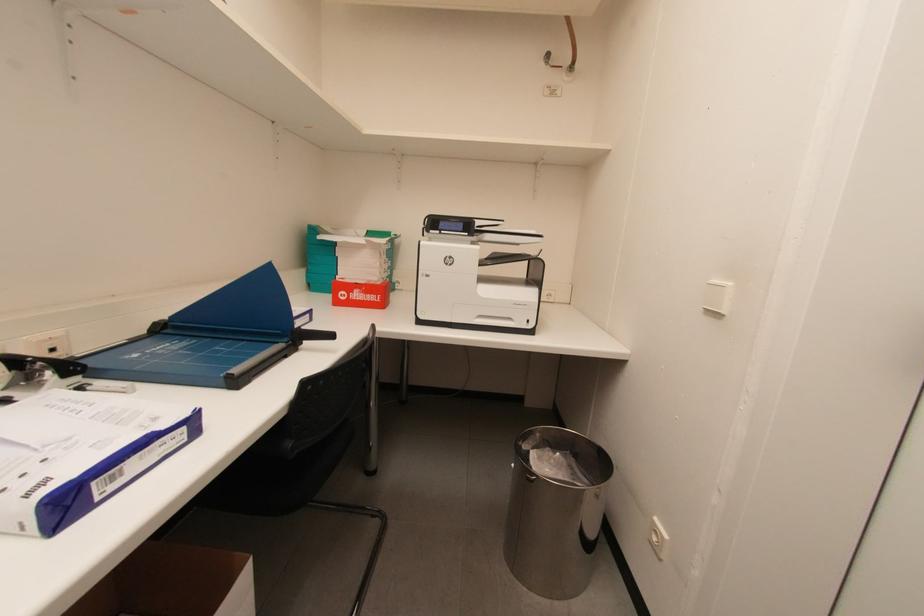
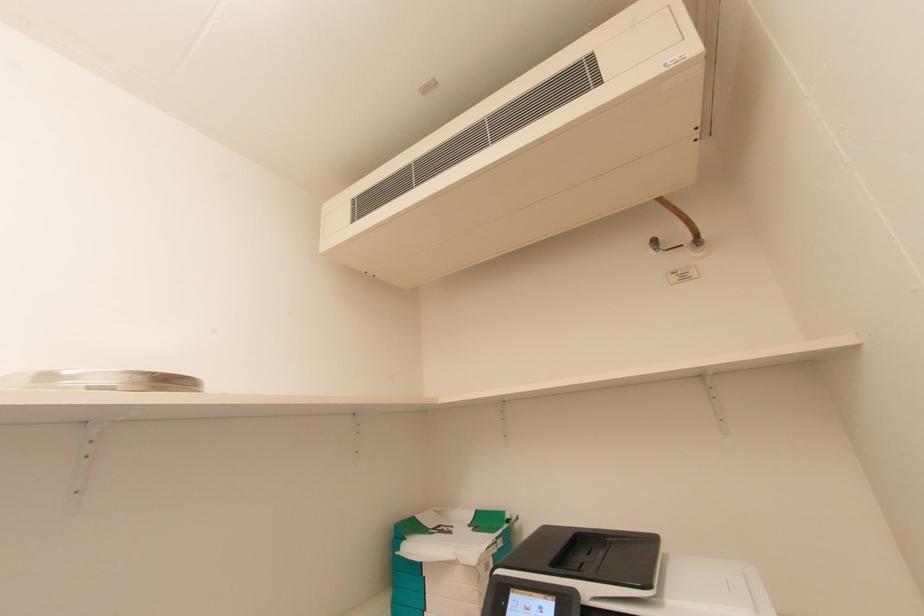
How did the camera likely rotate?

The camera rotated toward left-up.